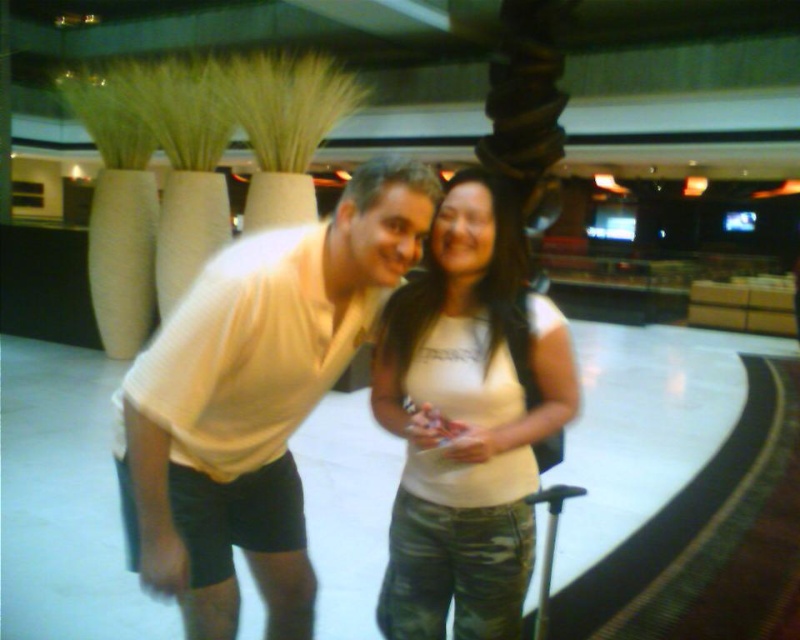
Question: Can you confirm if white matte shirt at center is positioned to the left of camouflage fabric suitcase at lower right?

Choices:
 (A) no
 (B) yes

Answer: (B)

Question: Which point is farther to the camera?

Choices:
 (A) (526, 346)
 (B) (210, 426)
 (C) (572, 488)

Answer: (B)

Question: Which point is closer to the camera taking this photo?

Choices:
 (A) pos(292,314)
 (B) pos(482,180)
 (C) pos(544,593)

Answer: (A)

Question: Does white matte tank top at center have a greater width compared to camouflage fabric suitcase at lower right?

Choices:
 (A) no
 (B) yes

Answer: (B)

Question: Which object is closer to the camera taking this photo?

Choices:
 (A) camouflage fabric suitcase at lower right
 (B) white matte tank top at center
 (C) white matte shirt at center

Answer: (C)

Question: Is white matte shirt at center smaller than camouflage fabric suitcase at lower right?

Choices:
 (A) no
 (B) yes

Answer: (A)